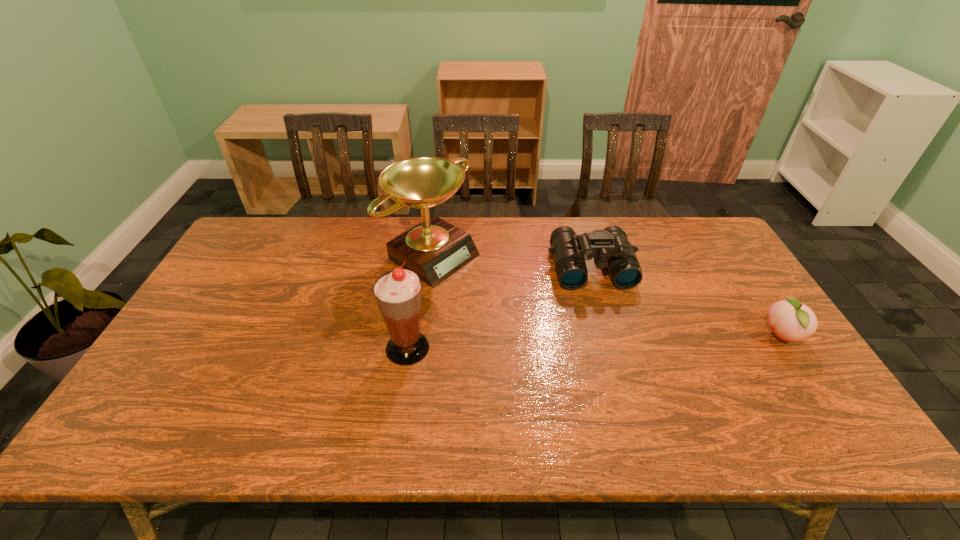
You are a GUI agent. You are given a task and a screenshot of the screen. Output one action in this format:
    pyautogui.click(x=<x>, y=<y>)
    Task: Click on the vacant space at the far left corner of the desktop
    This screenshot has height=540, width=960.
    Given the screenshot: What is the action you would take?
    pyautogui.click(x=252, y=235)

You are a GUI agent. You are given a task and a screenshot of the screen. Output one action in this format:
    pyautogui.click(x=<x>, y=<y>)
    Task: Click on the vacant region at the near left corner of the desktop
    
    Given the screenshot: What is the action you would take?
    [170, 395]

Locate an element on the screen. The height and width of the screenshot is (540, 960). vacant region at the far right corner of the desktop is located at coordinates (681, 248).

This screenshot has height=540, width=960. I want to click on free space at the near right corner of the desktop, so click(767, 388).

Where is `vacant area between the award and the rightmost object`? Image resolution: width=960 pixels, height=540 pixels. vacant area between the award and the rightmost object is located at coordinates (608, 295).

Locate an element on the screen. vacant region between the award and the binoculars is located at coordinates (513, 261).

You are a GUI agent. You are given a task and a screenshot of the screen. Output one action in this format:
    pyautogui.click(x=<x>, y=<y>)
    Task: Click on the free space between the shortest object and the award
    Image resolution: width=960 pixels, height=540 pixels.
    Given the screenshot: What is the action you would take?
    pyautogui.click(x=608, y=295)

At what (x,y) coordinates should I click in order to perform the action: click on empty location between the smoothie and the rightmost object. Please return your answer as a coordinate pair (x, y). The height and width of the screenshot is (540, 960). Looking at the image, I should click on (594, 342).

The height and width of the screenshot is (540, 960). I want to click on free area in between the binoculars and the award, so (513, 261).

The height and width of the screenshot is (540, 960). In order to click on vacant point located between the third tallest object and the peach in this screenshot , I will do `click(686, 302)`.